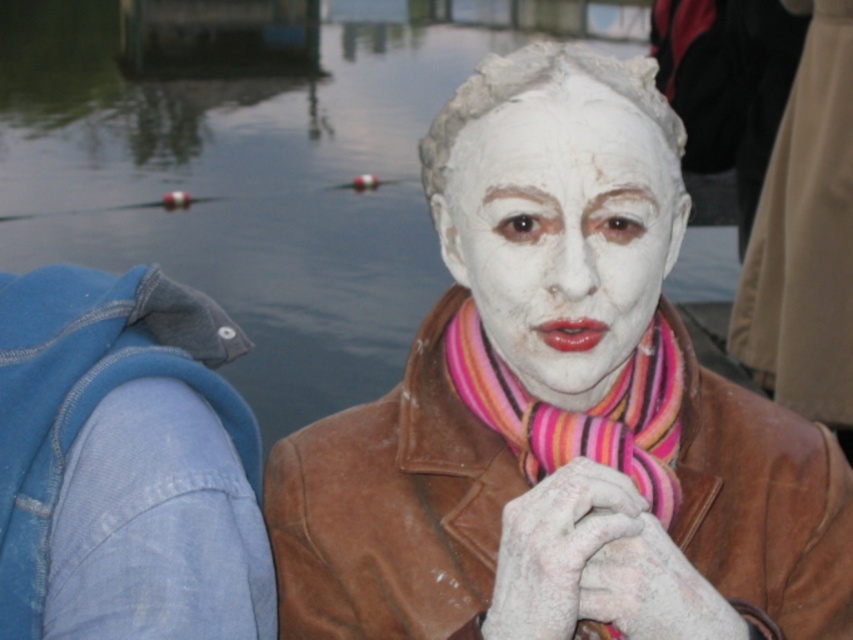
Question: Considering the relative positions of white clay mask at center and glossy water at center in the image provided, where is white clay mask at center located with respect to glossy water at center?

Choices:
 (A) right
 (B) left

Answer: (A)

Question: Is glossy water at center to the right of white matte face at center from the viewer's perspective?

Choices:
 (A) no
 (B) yes

Answer: (A)

Question: Which point is farther to the camera?

Choices:
 (A) (463, 324)
 (B) (596, 230)
 (C) (15, 372)
 (D) (778, 508)

Answer: (C)

Question: Where is glossy water at center located in relation to white matte face at center in the image?

Choices:
 (A) left
 (B) right

Answer: (A)

Question: Which point is closer to the camera?

Choices:
 (A) white clay mask at center
 (B) striped wool scarf at center
 (C) glossy water at center
 (D) white matte face at center

Answer: (A)

Question: Which object is farther from the camera taking this photo?

Choices:
 (A) glossy water at center
 (B) denim jacket at left
 (C) white clay mask at center
 (D) white matte face at center

Answer: (A)